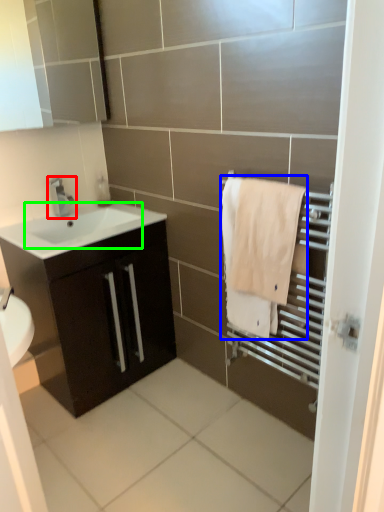
Question: Which is nearer to the tap (highlighted by a red box)? bath towel (highlighted by a blue box) or sink (highlighted by a green box).

Choices:
 (A) bath towel
 (B) sink

Answer: (B)